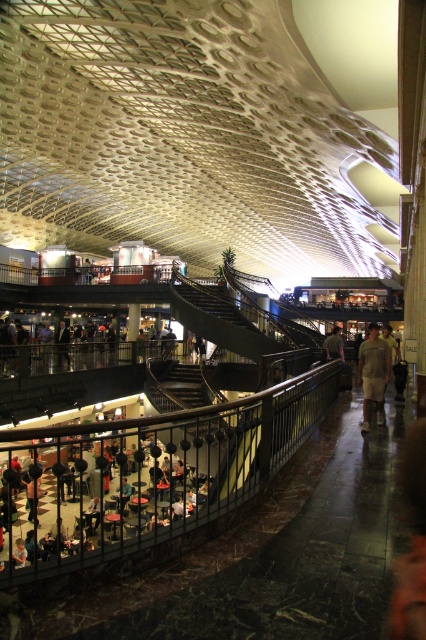
Who is more forward, (x=63, y=340) or (x=334, y=339)?

Positioned in front is point (x=334, y=339).

Does dark gray suit at center appear on the left side of brown leather jacket at center?

Correct, you'll find dark gray suit at center to the left of brown leather jacket at center.

Is point (65, 355) less distant than point (331, 339)?

No, (65, 355) is behind (331, 339).

Locate an element on the screen. Image resolution: width=426 pixels, height=640 pixels. dark gray suit at center is located at coordinates (62, 342).

Can you confirm if dark brown wooden stairs at center is wider than dark gray suit at center?

No.

Between dark brown wooden stairs at center and dark gray suit at center, which one appears on the left side from the viewer's perspective?

From the viewer's perspective, dark gray suit at center appears more on the left side.

Between point (161, 392) and point (60, 339), which one is positioned behind?

The point (60, 339) is behind.

Where is `dark brown wooden stairs at center`? Image resolution: width=426 pixels, height=640 pixels. dark brown wooden stairs at center is located at coordinates (178, 385).

Does khaki cotton pants at center appear on the right side of dark gray suit at center?

Yes, khaki cotton pants at center is to the right of dark gray suit at center.

Which is more to the left, khaki cotton pants at center or dark gray suit at center?

dark gray suit at center

Who is more forward, (365,360) or (65,337)?

Point (365,360) is more forward.

In order to click on khaki cotton pants at center in this screenshot , I will do `click(374, 372)`.